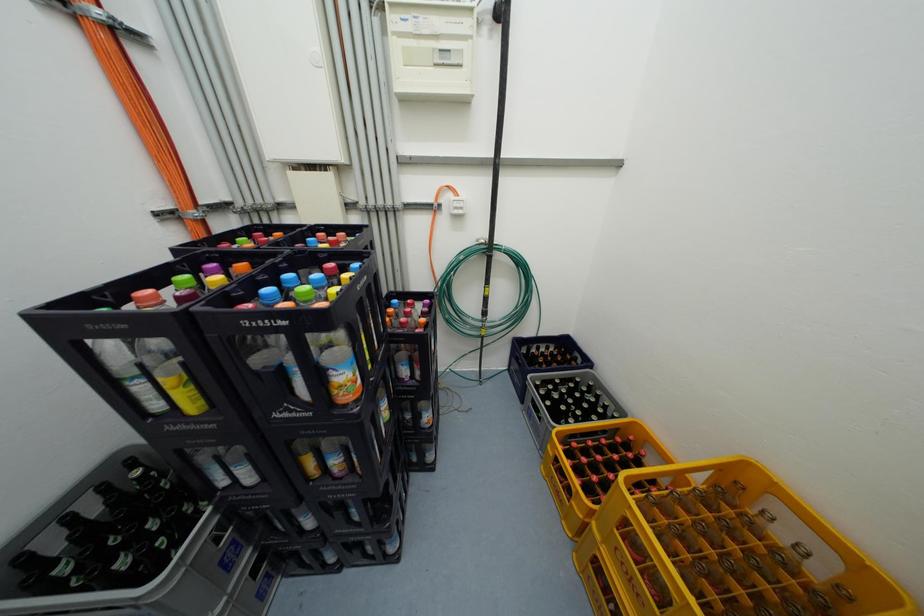
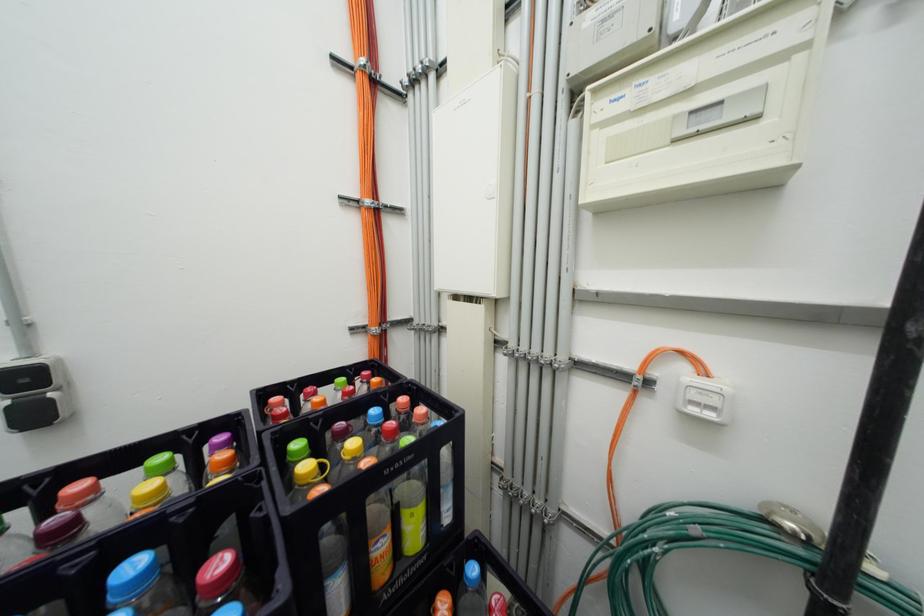
Question: The camera is either moving clockwise (left) or counter-clockwise (right) around the object. The first image is from the beginning of the video and the second image is from the end. Is the camera moving left or right when shooting the video?

Choices:
 (A) Left
 (B) Right

Answer: (B)